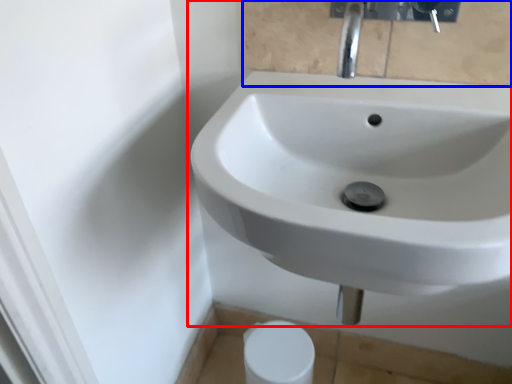
Question: Among these objects, which one is nearest to the camera, sink (highlighted by a red box) or mirror (highlighted by a blue box)?

Choices:
 (A) sink
 (B) mirror

Answer: (A)